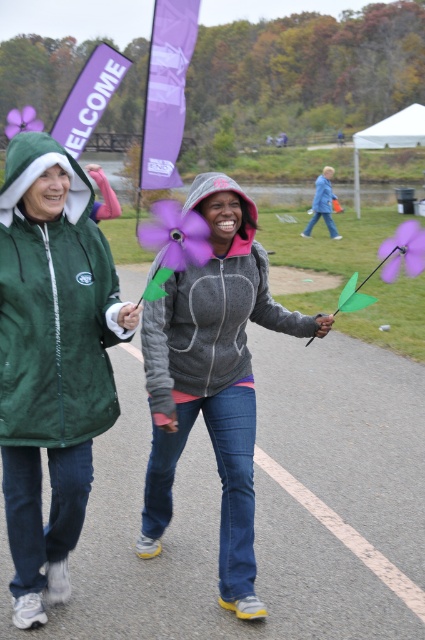
Question: Is green fleece jacket at left bigger than gray hoodie at center?

Choices:
 (A) yes
 (B) no

Answer: (B)

Question: Can you confirm if green fleece jacket at left is wider than gray hoodie at center?

Choices:
 (A) no
 (B) yes

Answer: (A)

Question: Is green fleece jacket at left further to camera compared to gray hoodie at center?

Choices:
 (A) no
 (B) yes

Answer: (A)

Question: Which point is farther to the camera?

Choices:
 (A) gray hoodie at center
 (B) green fleece jacket at left

Answer: (A)

Question: Among these objects, which one is nearest to the camera?

Choices:
 (A) gray hoodie at center
 (B) green fleece jacket at left

Answer: (B)